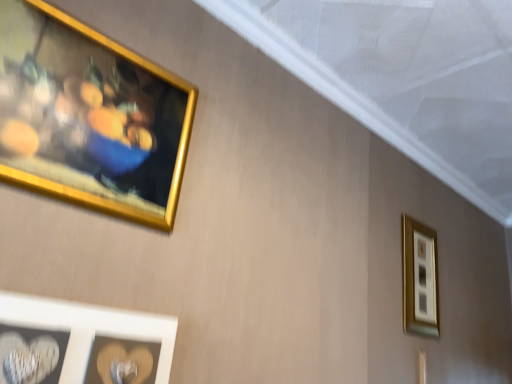
Question: Is gold metallic picture frame at upper left, which is the 1th picture frame from left to right, far from gold metallic picture frame at upper right, the first picture frame in the back-to-front sequence?

Choices:
 (A) yes
 (B) no

Answer: (A)

Question: Does gold metallic picture frame at upper left, placed as the second picture frame when sorted from back to front, have a lesser height compared to gold metallic picture frame at upper right, marked as the first picture frame in a right-to-left arrangement?

Choices:
 (A) yes
 (B) no

Answer: (A)

Question: Is gold metallic picture frame at upper left, which is the 1th picture frame from left to right, outside gold metallic picture frame at upper right, the first picture frame in the back-to-front sequence?

Choices:
 (A) no
 (B) yes

Answer: (B)

Question: From the image's perspective, does gold metallic picture frame at upper left, the 3th picture frame from the right, appear higher than gold metallic picture frame at upper right, the third picture frame when ordered from front to back?

Choices:
 (A) yes
 (B) no

Answer: (A)

Question: Is gold metallic picture frame at upper left, placed as the second picture frame when sorted from back to front, in front of gold metallic picture frame at upper right, the 3th picture frame in the left-to-right sequence?

Choices:
 (A) yes
 (B) no

Answer: (A)

Question: From the image's perspective, would you say gold metallic picture frame at upper left, the 3th picture frame from the right, is shown under gold metallic picture frame at upper right, the 3th picture frame in the left-to-right sequence?

Choices:
 (A) yes
 (B) no

Answer: (B)

Question: From the image's perspective, is gold metallic picture frame at upper right, marked as the first picture frame in a right-to-left arrangement, over gold metallic picture frame at upper left, which is the second picture frame in front-to-back order?

Choices:
 (A) no
 (B) yes

Answer: (A)

Question: Are gold metallic picture frame at upper right, the 3th picture frame in the left-to-right sequence, and gold metallic picture frame at upper left, which is the 1th picture frame from left to right, making contact?

Choices:
 (A) yes
 (B) no

Answer: (B)

Question: Does gold metallic picture frame at upper right, marked as the first picture frame in a right-to-left arrangement, have a lesser height compared to gold metallic picture frame at upper left, which is the second picture frame in front-to-back order?

Choices:
 (A) no
 (B) yes

Answer: (A)

Question: From a real-world perspective, is gold metallic picture frame at upper right, the 3th picture frame in the left-to-right sequence, under gold metallic picture frame at upper left, placed as the second picture frame when sorted from back to front?

Choices:
 (A) no
 (B) yes

Answer: (B)

Question: From a real-world perspective, is gold metallic picture frame at upper right, marked as the first picture frame in a right-to-left arrangement, positioned over gold metallic picture frame at upper left, which is the second picture frame in front-to-back order, based on gravity?

Choices:
 (A) no
 (B) yes

Answer: (A)

Question: Does gold metallic picture frame at upper right, the third picture frame when ordered from front to back, contain gold metallic picture frame at upper left, which is the 1th picture frame from left to right?

Choices:
 (A) no
 (B) yes

Answer: (A)

Question: Considering the relative positions of white matte heart at lower left, which is the 2th picture frame from right to left, and gold metallic picture frame at upper right, the third picture frame when ordered from front to back, in the image provided, is white matte heart at lower left, which is the 2th picture frame from right to left, in front of gold metallic picture frame at upper right, the third picture frame when ordered from front to back,?

Choices:
 (A) yes
 (B) no

Answer: (A)